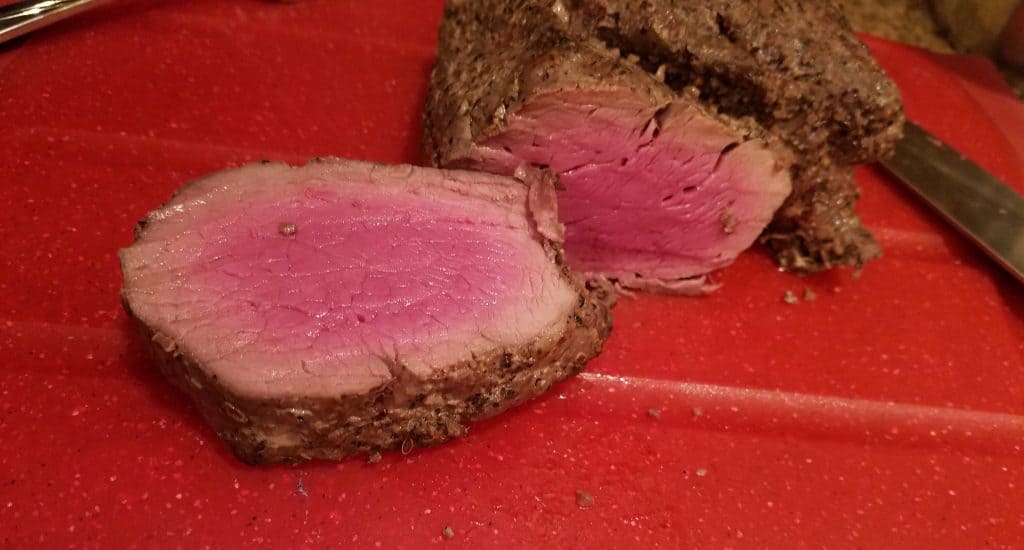
This screenshot has height=550, width=1024. I want to click on tray, so click(x=825, y=411).